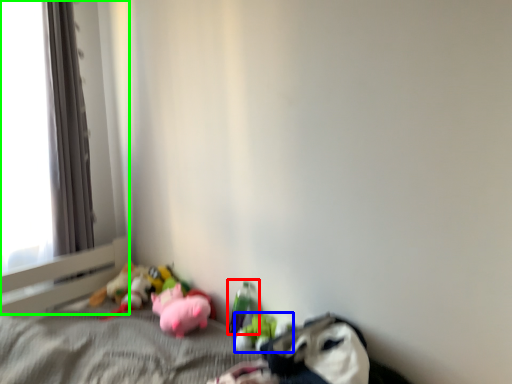
Question: Based on their relative distances, which object is farther from toy (highlighted by a red box)? Choose from toy (highlighted by a blue box) and window frame (highlighted by a green box).

Choices:
 (A) toy
 (B) window frame

Answer: (B)